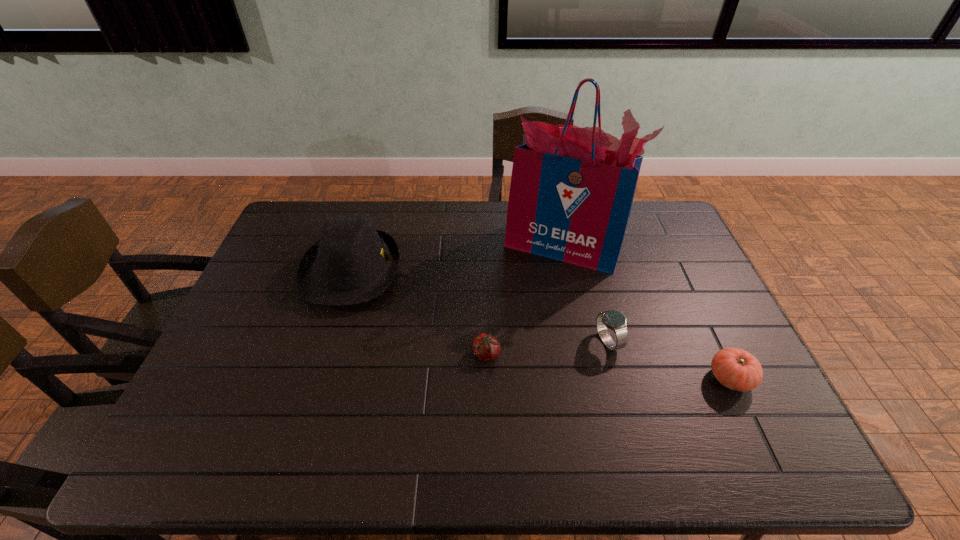
Find the location of a particular element. The height and width of the screenshot is (540, 960). vacant point located 0.370m on the back of the watch is located at coordinates (583, 243).

You are a GUI agent. You are given a task and a screenshot of the screen. Output one action in this format:
    pyautogui.click(x=<x>, y=<y>)
    Task: Click on the vacant space located 0.250m on the back of the second shortest object
    The image size is (960, 540).
    Given the screenshot: What is the action you would take?
    pyautogui.click(x=689, y=292)

Where is `blank space located on the left of the fourth object from right to left`? The image size is (960, 540). blank space located on the left of the fourth object from right to left is located at coordinates (409, 354).

Locate an element on the screen. Image resolution: width=960 pixels, height=540 pixels. grocery bag at the far edge is located at coordinates (571, 193).

Where is `fedora that is at the far edge`? The width and height of the screenshot is (960, 540). fedora that is at the far edge is located at coordinates (352, 263).

Locate an element on the screen. object positioned at the left edge is located at coordinates (352, 263).

I want to click on object that is at the right edge, so click(x=735, y=368).

Where is `object present at the far left corner`? The width and height of the screenshot is (960, 540). object present at the far left corner is located at coordinates (352, 263).

Identify the location of vacant space at the far edge of the desktop. (374, 220).

Where is `vacant space at the near edge of the desktop`? The width and height of the screenshot is (960, 540). vacant space at the near edge of the desktop is located at coordinates (622, 438).